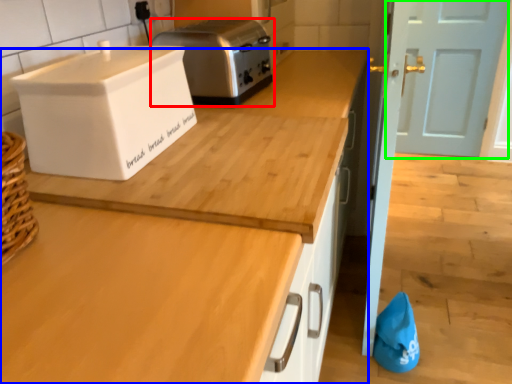
Question: Estimate the real-world distances between objects in this image. Which object is closer to toaster (highlighted by a red box), countertop (highlighted by a blue box) or door (highlighted by a green box)?

Choices:
 (A) countertop
 (B) door

Answer: (A)